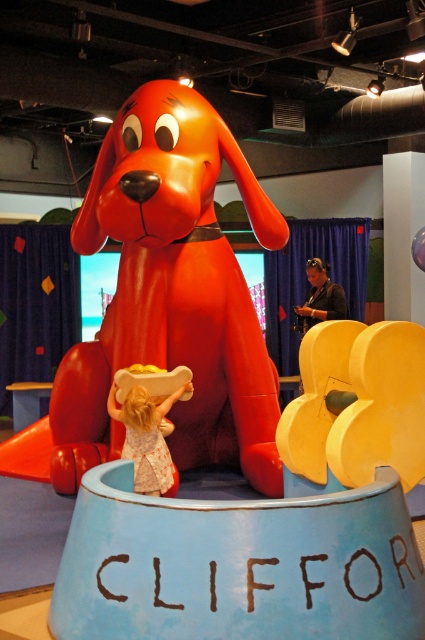
You are a game developer designing a virtual reality experience based on the image. You need to place a virtual treat exactly at the same 2D coordinates as the glossy plastic dog at center. What coordinates should you use?

The glossy plastic dog at center is located at point (167, 298), so you should place the virtual treat at those coordinates.

You are a parent at the park and want to take a photo of your child with the glossy plastic dog at center and the light pink fabric dress at center. Which object should you focus on first to ensure both are in the frame?

You should focus on the glossy plastic dog at center first since it is larger than the light pink fabric dress at center, ensuring it fits within the camera frame before adjusting for the smaller dress.

From the picture: You are a parent supervising a child at a children museum. You see the glossy plastic dog at center and the light pink fabric dress at center. Which object is closer to you?

The glossy plastic dog at center is closer to you because the light pink fabric dress at center is behind it.